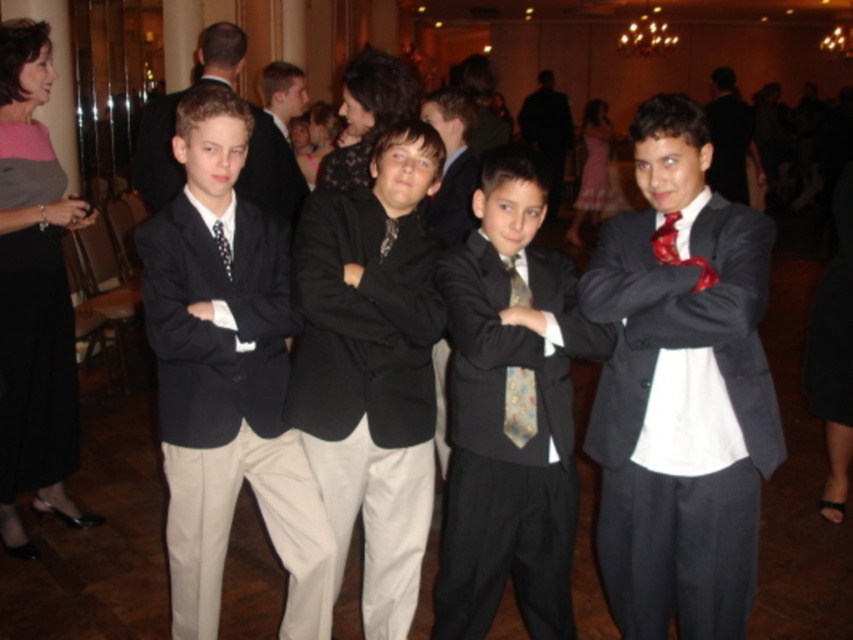
You are standing in front of the group of four boys at the event. You want to take a photo of the boy at point (546, 500) and the boy at point (714, 109). Which boy is closer to the camera?

The boy at point (546, 500) is closer to the camera than the boy at point (714, 109).

Consider the image. You are a photographer at a formal event. You need to arrange two suits in the image for a photo shoot. The shiny black suit at center and the matte black suit at upper right. Which suit is taller?

The shiny black suit at center is taller than the matte black suit at upper right according to the description.